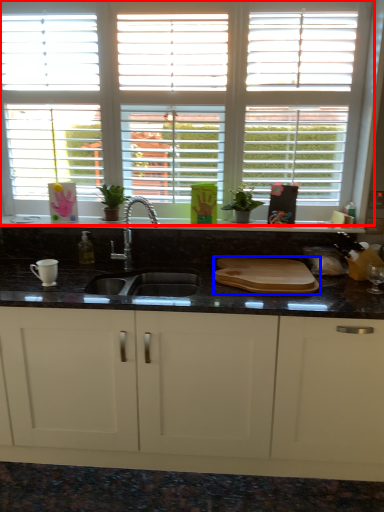
Question: Which of the following is the closest to the observer, window (highlighted by a red box) or tray (highlighted by a blue box)?

Choices:
 (A) window
 (B) tray

Answer: (B)